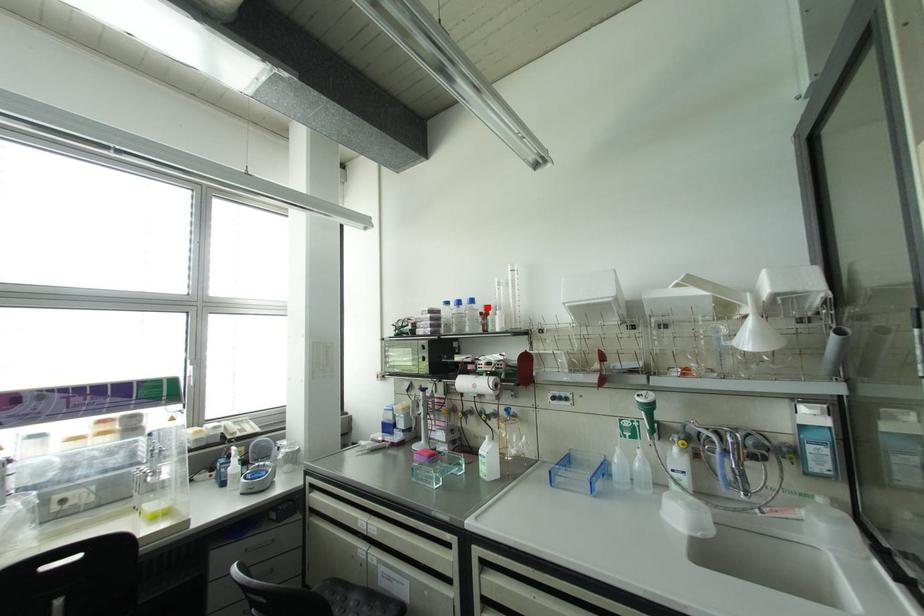
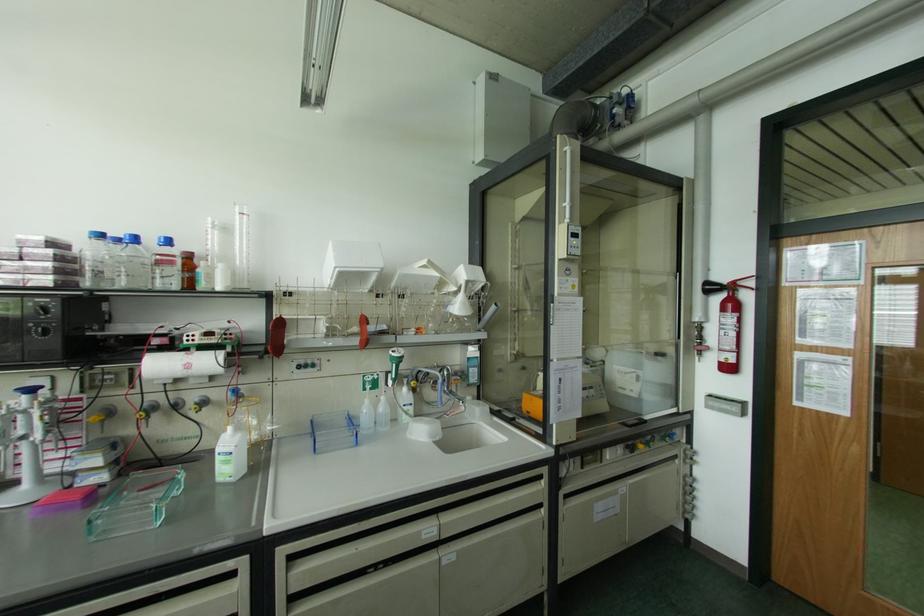
The point at the highlighted location is marked in the first image. Where is the corresponding point in the second image?

(188, 256)